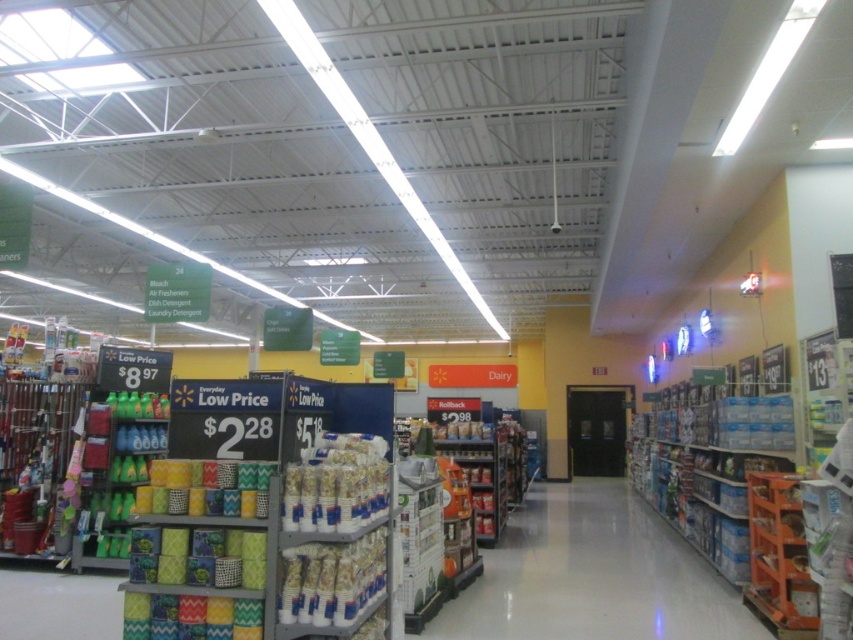
Looking at this image, does orange cardboard boxes at center have a greater width compared to matte plastic bottles at left?

Indeed, orange cardboard boxes at center has a greater width compared to matte plastic bottles at left.

Which is in front, point (664, 566) or point (106, 420)?

Point (106, 420) is more forward.

The image size is (853, 640). Identify the location of orange cardboard boxes at center. (592, 577).

Can you confirm if matte plastic bottles at left is positioned to the left of white paper towels at center?

Correct, you'll find matte plastic bottles at left to the left of white paper towels at center.

Can you confirm if matte plastic bottles at left is smaller than white paper towels at center?

No, matte plastic bottles at left is not smaller than white paper towels at center.

Between point (86, 452) and point (380, 515), which one is positioned behind?

Point (86, 452)

The width and height of the screenshot is (853, 640). Identify the location of matte plastic bottles at left. (115, 476).

Does point (550, 600) come in front of point (383, 448)?

No, it is not.

The width and height of the screenshot is (853, 640). Find the location of `orange cardboard boxes at center`. orange cardboard boxes at center is located at coordinates (592, 577).